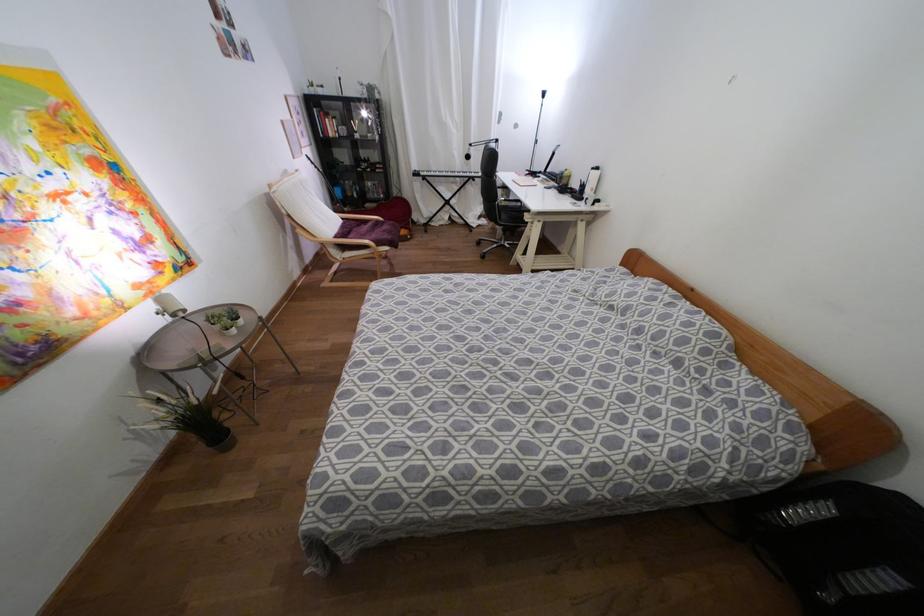
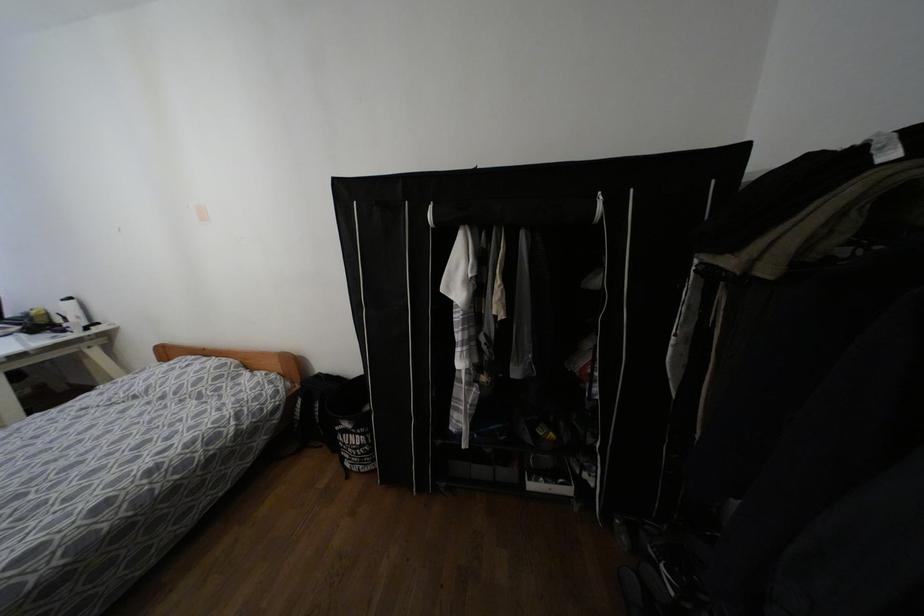
Find the pixel in the second image that matches (x=596, y=168) in the first image.

(68, 299)